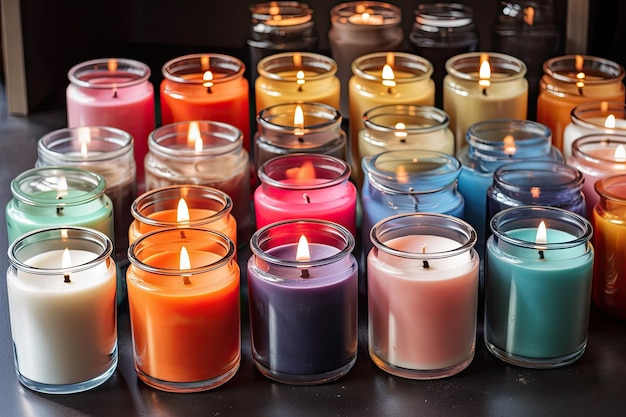
Find the location of `leftmost column of candles`. leftmost column of candles is located at coordinates [x=111, y=85], [x=103, y=148], [x=66, y=198], [x=69, y=293].